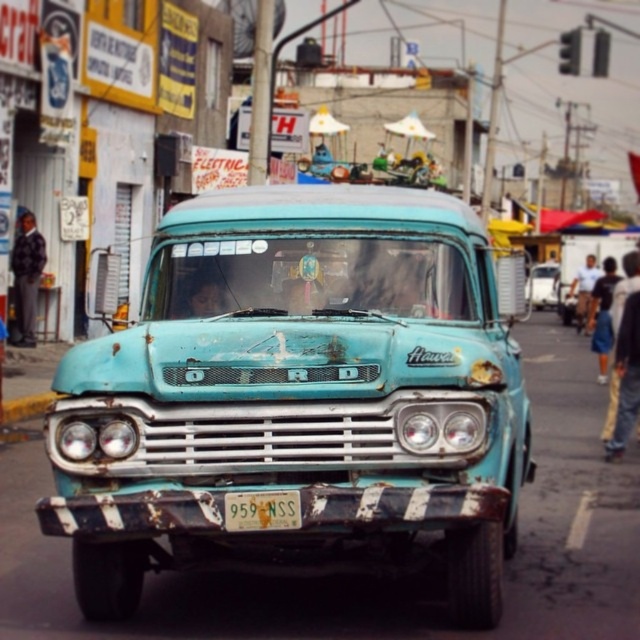
Question: Among these points, which one is farthest from the camera?

Choices:
 (A) (182, 492)
 (B) (225, 518)

Answer: (A)

Question: Considering the relative positions of rusty teal pickup truck at center and yellow matte license plate at center in the image provided, where is rusty teal pickup truck at center located with respect to yellow matte license plate at center?

Choices:
 (A) left
 (B) right

Answer: (B)

Question: Which of the following is the closest to the observer?

Choices:
 (A) (321, 336)
 (B) (282, 518)

Answer: (B)

Question: Is rusty teal pickup truck at center wider than yellow matte license plate at center?

Choices:
 (A) yes
 (B) no

Answer: (A)

Question: Which point is closer to the camera taking this photo?

Choices:
 (A) [244, 515]
 (B) [412, 346]

Answer: (A)

Question: Can you confirm if rusty teal pickup truck at center is positioned to the left of yellow matte license plate at center?

Choices:
 (A) yes
 (B) no

Answer: (B)